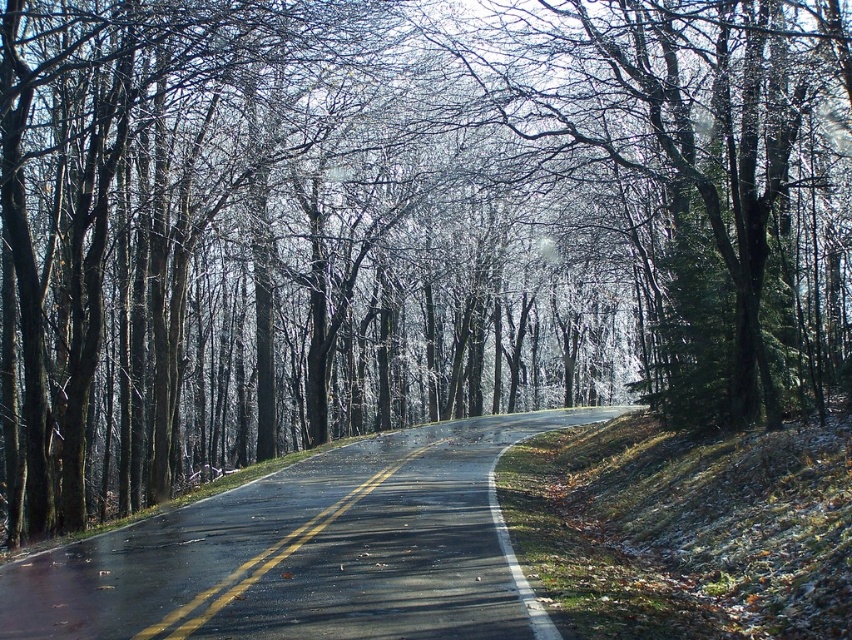
Question: Among these objects, which one is farthest from the camera?

Choices:
 (A) black asphalt road at center
 (B) glossy bark tree at center

Answer: (B)

Question: Is glossy bark tree at center smaller than black asphalt road at center?

Choices:
 (A) no
 (B) yes

Answer: (A)

Question: Is glossy bark tree at center thinner than black asphalt road at center?

Choices:
 (A) yes
 (B) no

Answer: (B)

Question: Does glossy bark tree at center appear over black asphalt road at center?

Choices:
 (A) no
 (B) yes

Answer: (B)

Question: Among these points, which one is farthest from the camera?

Choices:
 (A) (571, 116)
 (B) (183, 628)

Answer: (A)

Question: Among these objects, which one is nearest to the camera?

Choices:
 (A) black asphalt road at center
 (B) glossy bark tree at center

Answer: (A)